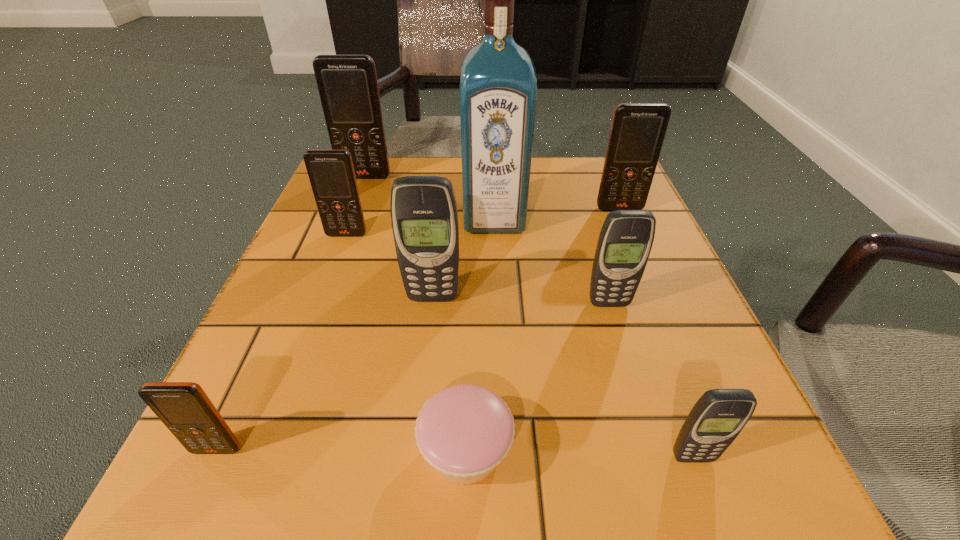
You are a GUI agent. You are given a task and a screenshot of the screen. Output one action in this format:
    pyautogui.click(x=<x>, y=<y>)
    Task: Click on the closest gray cellular telephone to the second smallest orange cellular telephone
    The height and width of the screenshot is (540, 960).
    Given the screenshot: What is the action you would take?
    pyautogui.click(x=424, y=216)

Image resolution: width=960 pixels, height=540 pixels. In order to click on the second closest gray cellular telephone to the liquor in this screenshot , I will do `click(626, 238)`.